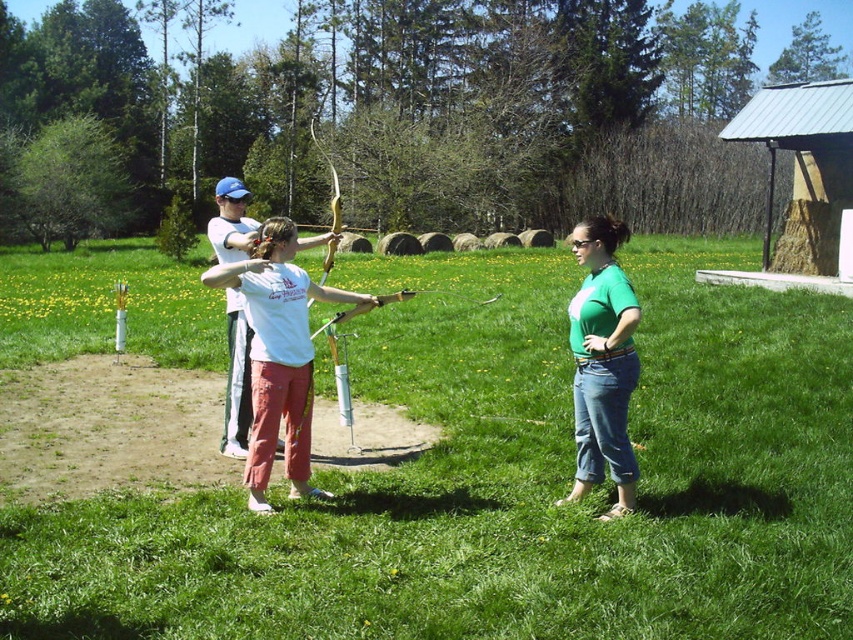
Question: Estimate the real-world distances between objects in this image. Which object is closer to the green matte shirt at center?

Choices:
 (A) green grass at center
 (B) white matte shirt at center

Answer: (B)

Question: Which point is closer to the camera taking this photo?

Choices:
 (A) (519, 634)
 (B) (277, 340)
 (C) (633, 317)

Answer: (A)

Question: Does green grass at center appear over wooden bow at center?

Choices:
 (A) yes
 (B) no

Answer: (A)

Question: Which point is closer to the camera?

Choices:
 (A) white matte shirt at center
 (B) green matte shirt at center
 (C) wooden bow at center

Answer: (B)

Question: Considering the relative positions of green grass at center and wooden bow at center in the image provided, where is green grass at center located with respect to wooden bow at center?

Choices:
 (A) above
 (B) below

Answer: (A)

Question: Where is green grass at center located in relation to green matte shirt at center in the image?

Choices:
 (A) below
 (B) above

Answer: (B)